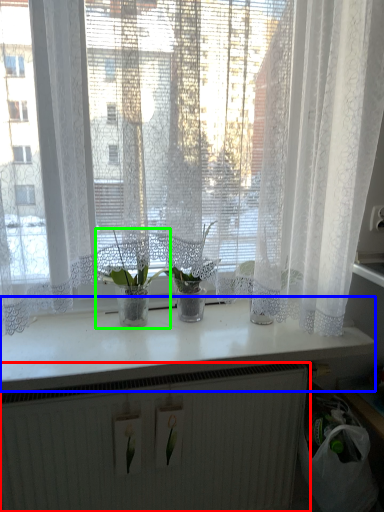
Question: Which is farther away from radiator (highlighted by a red box)? counter top (highlighted by a blue box) or houseplant (highlighted by a green box)?

Choices:
 (A) counter top
 (B) houseplant

Answer: (B)